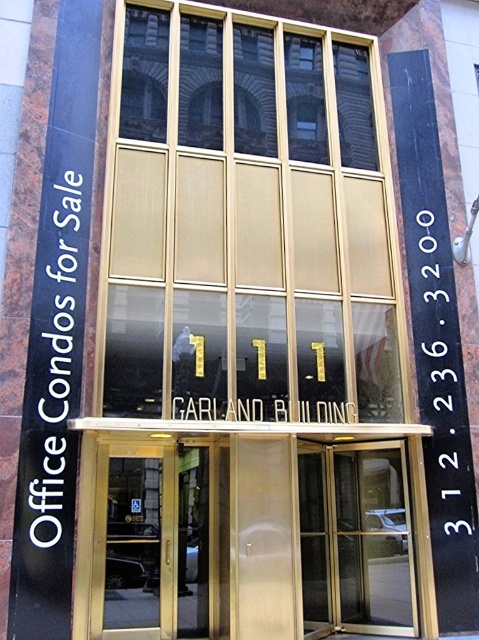
Can you confirm if gold frosted glass at center is shorter than gold metallic doors at center?

No, gold frosted glass at center is not shorter than gold metallic doors at center.

Is gold frosted glass at center bigger than gold metallic doors at center?

Yes, gold frosted glass at center is bigger than gold metallic doors at center.

Describe the element at coordinates (247, 218) in the screenshot. I see `gold frosted glass at center` at that location.

Find the location of `gold frosted glass at center`. gold frosted glass at center is located at coordinates (247, 218).

Can you confirm if gold frosted glass at center is smaller than transparent glass door at center?

No, gold frosted glass at center is not smaller than transparent glass door at center.

Between gold frosted glass at center and transparent glass door at center, which one is positioned higher?

gold frosted glass at center is above.

Measure the distance between gold frosted glass at center and camera.

gold frosted glass at center is 6.21 meters away from camera.

Identify the location of gold frosted glass at center. (x=247, y=218).

Who is taller, gold metallic doors at center or gold glass doors at center?

With more height is gold metallic doors at center.

Identify the location of gold metallic doors at center. (252, 528).

Where is `gold metallic doors at center`? gold metallic doors at center is located at coordinates (252, 528).